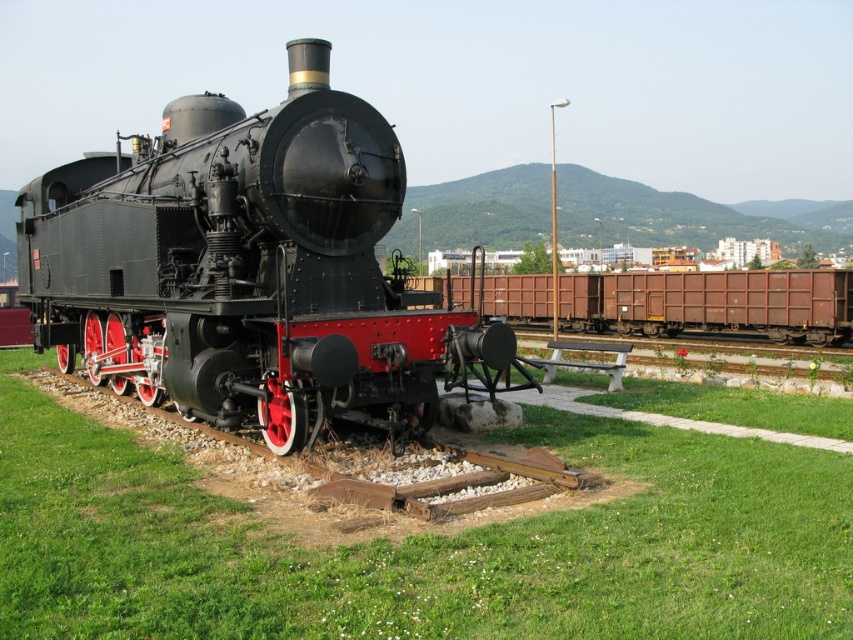
You are a tour guide explaining the layout of the railway exhibit to visitors. You mention both the polished black steam locomotive at center and the rusty metal train car at center. Which one is positioned to the left from the visitors perspective?

The polished black steam locomotive at center is positioned to the left of the rusty metal train car at center from the visitors perspective.